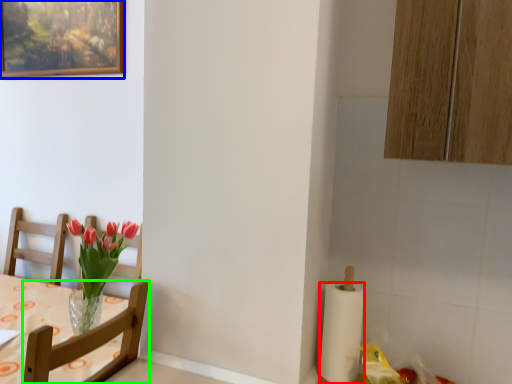
Question: Which object is the farthest from paper towel (highlighted by a red box)? Choose among these: picture frame (highlighted by a blue box) or chair (highlighted by a green box).

Choices:
 (A) picture frame
 (B) chair

Answer: (A)